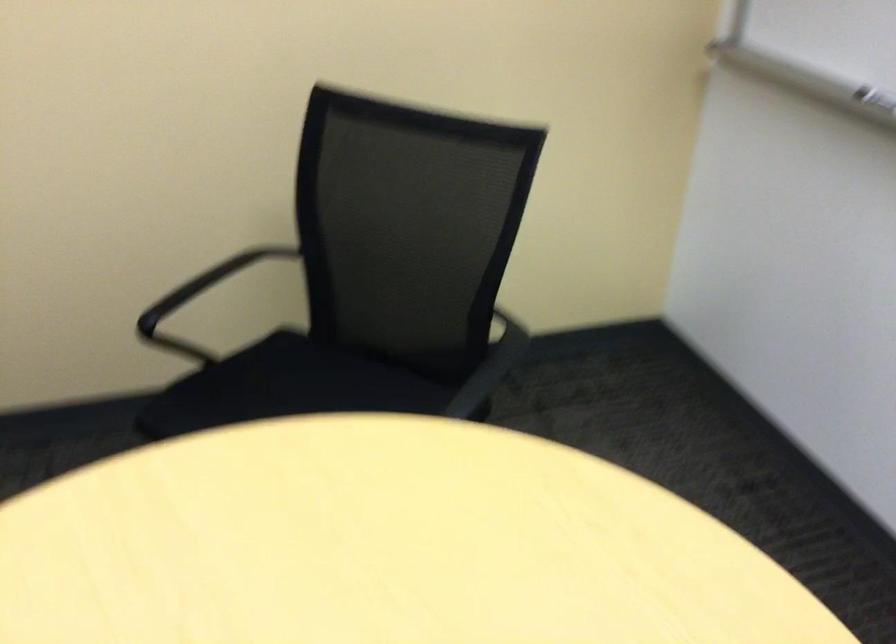
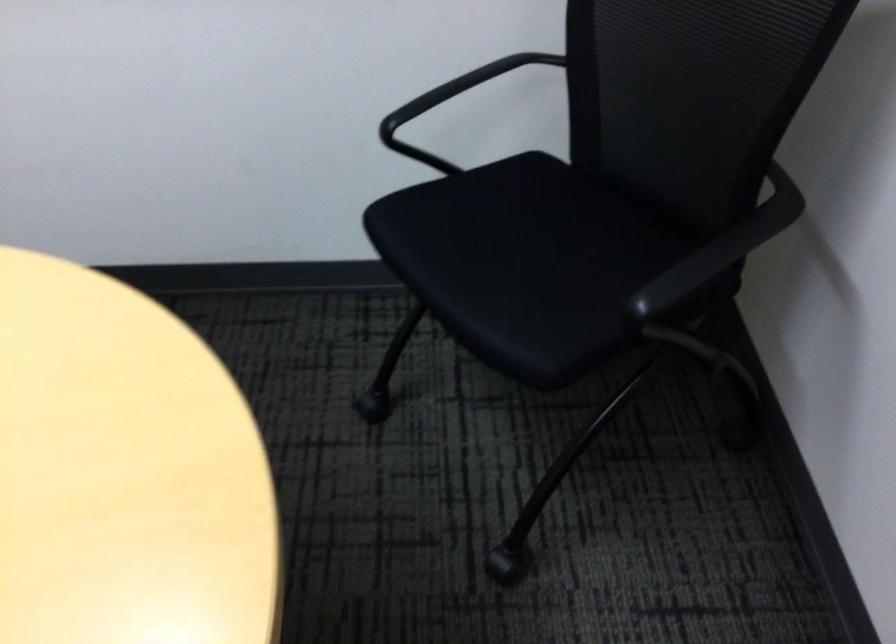
Based on the continuous images, in which direction is the camera rotating?

The camera's rotation is toward right-down.